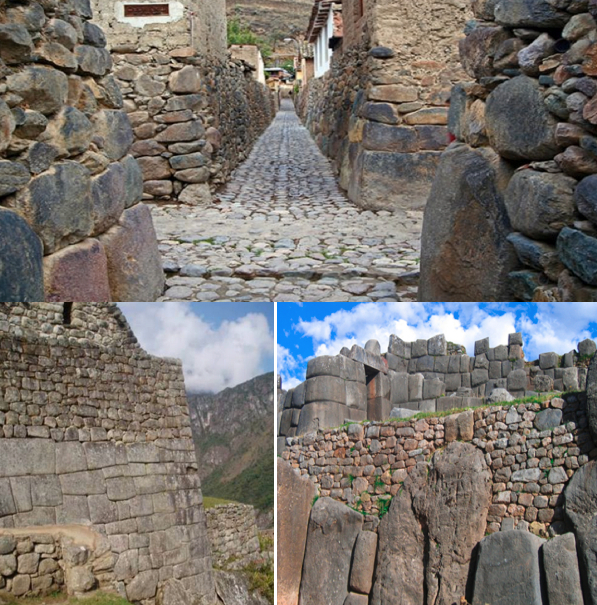
Where is `white window frames`? The image size is (597, 605). white window frames is located at coordinates (323, 54).